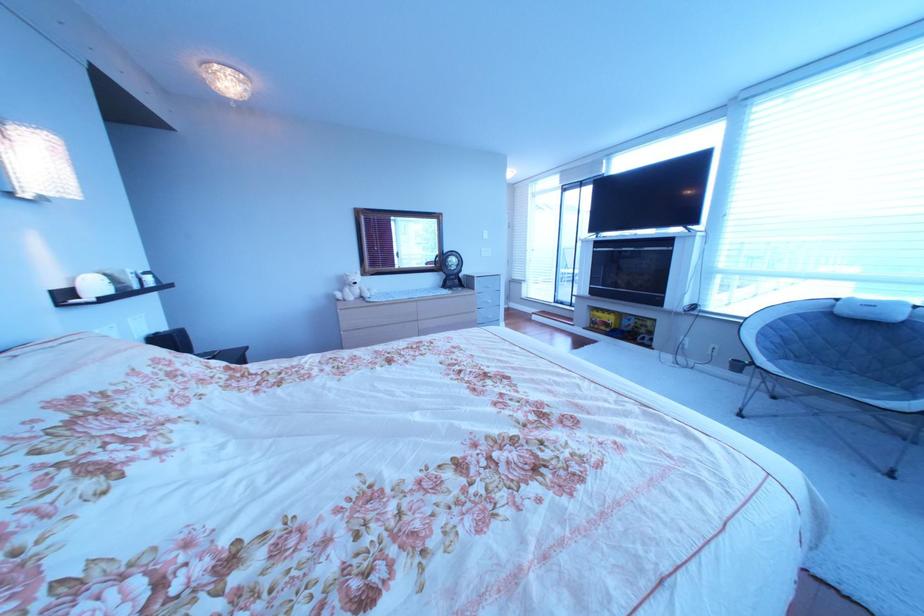
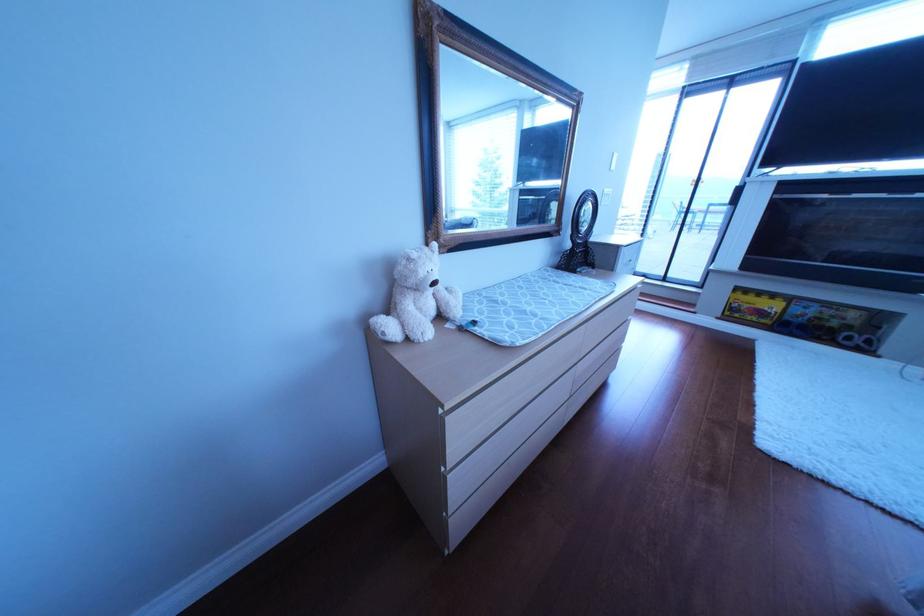
Where in the second image is the point corresponding to the point at 377,294 from the first image?

(458, 310)